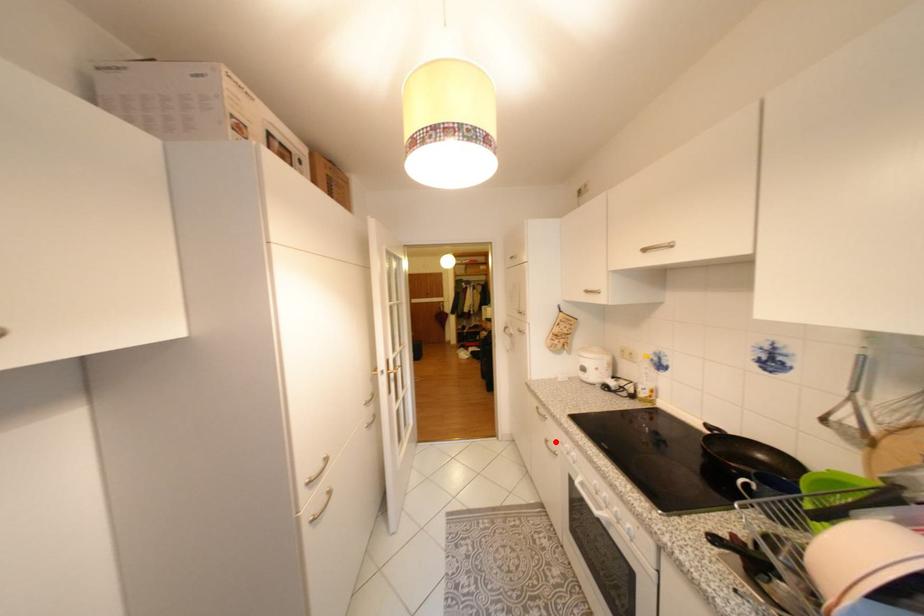
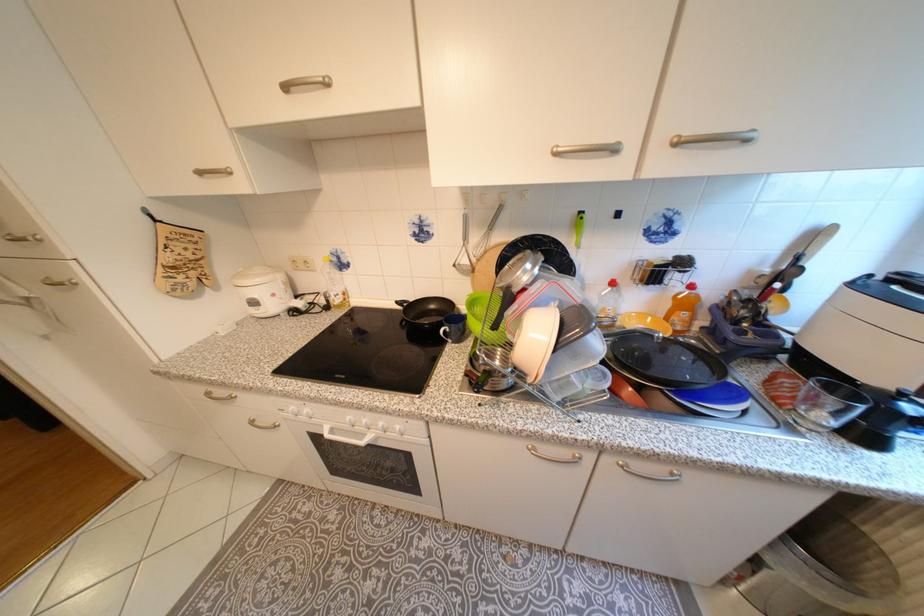
The point at the highlighted location is marked in the first image. Where is the corresponding point in the second image?

(261, 423)